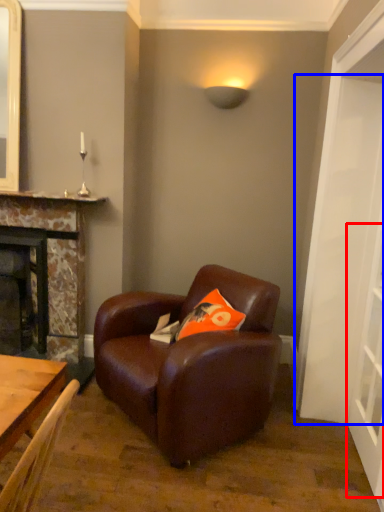
Question: Which object appears farthest to the camera in this image, glass door (highlighted by a red box) or door (highlighted by a blue box)?

Choices:
 (A) glass door
 (B) door

Answer: (A)